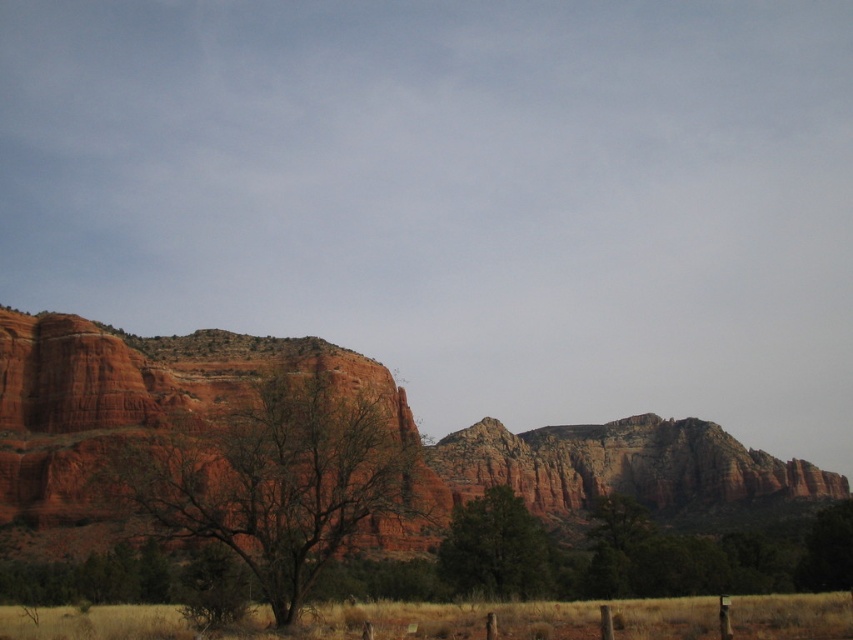
Question: Does rustic rock formation at center appear on the right side of smooth reddish-brown tree at center-left?

Choices:
 (A) no
 (B) yes

Answer: (B)

Question: Which point is farther to the camera?

Choices:
 (A) (762, 477)
 (B) (521, 564)

Answer: (A)

Question: Which object is the closest to the rustic rock formation at center?

Choices:
 (A) green matte tree at center
 (B) smooth reddish-brown tree at center-left

Answer: (B)

Question: Which object appears farthest from the camera in this image?

Choices:
 (A) rustic rock formation at center
 (B) green matte tree at center

Answer: (B)

Question: Does smooth reddish-brown tree at center-left have a lesser width compared to green matte tree at center?

Choices:
 (A) no
 (B) yes

Answer: (A)

Question: Can you confirm if smooth reddish-brown tree at center-left is positioned below green matte tree at center?

Choices:
 (A) no
 (B) yes

Answer: (A)